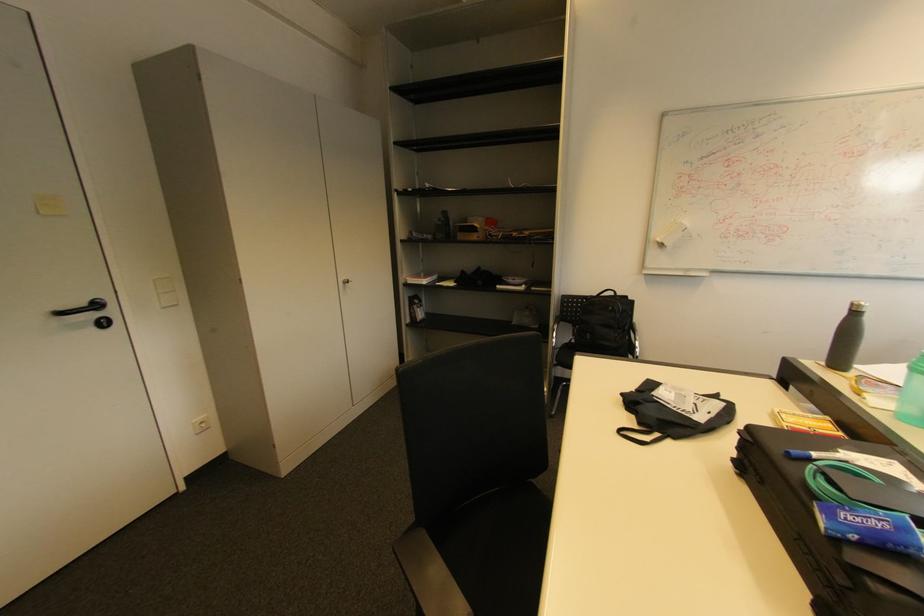
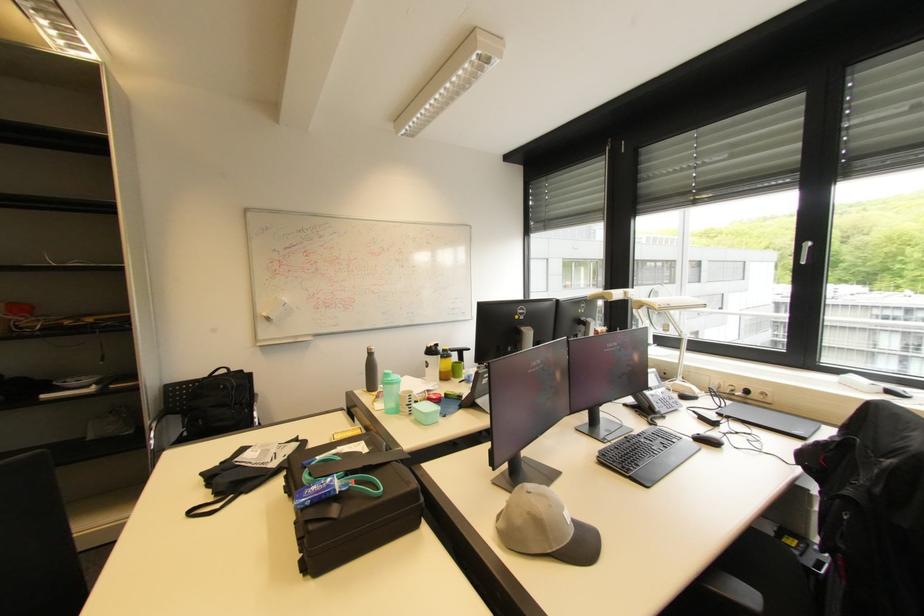
Locate, in the second image, the point that corresponds to (x=857, y=305) in the first image.

(372, 350)